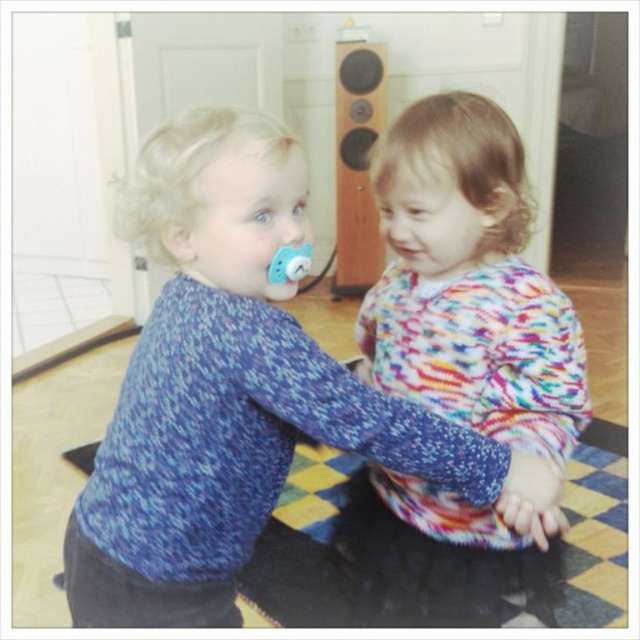
You are a photographer trying to capture a closeup of the blue knitted sweater at center and the pink matte lips at center. Since you want to focus on both objects equally, which one should you adjust the camera focus on first, considering their sizes?

The blue knitted sweater at center is larger than the pink matte lips at center, so you should focus on the blue knitted sweater at center first to ensure both fit well in the frame.

You are a photographer trying to capture a closeup of the blue knitted sweater at center and the pink matte lips at center. Since you want both subjects in focus, you need to know their distance apart. Based on the scene, can you determine which one is closer to the camera?

The blue knitted sweater at center is positioned on the left side of pink matte lips at center, so the blue knitted sweater at center is closer to the camera than the pink matte lips at center.

Looking at this image, you are a toy designer trying to create a storage box that can hold both the blue knitted sweater at center and the matte blue pacifier at left. What is the minimum length required for the storage box to accommodate both items side by side?

The minimum length required for the storage box is 10.37 inches to accommodate both the blue knitted sweater at center and the matte blue pacifier at left side by side.